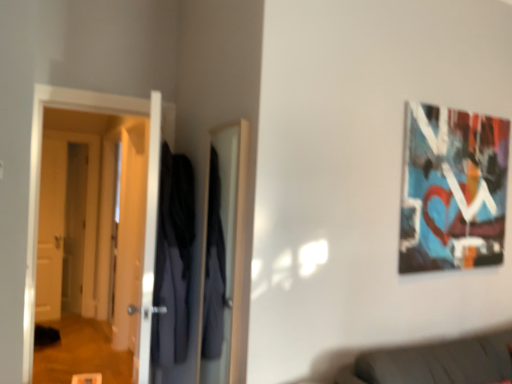
Question: Can you confirm if dark blue fabric robe at center is bigger than white glossy door at left, the first door viewed from the front?

Choices:
 (A) yes
 (B) no

Answer: (B)

Question: From the image's perspective, is dark blue fabric robe at center on top of white glossy door at left, arranged as the 1th door when viewed from the right?

Choices:
 (A) no
 (B) yes

Answer: (A)

Question: Is dark blue fabric robe at center positioned in front of white glossy door at left, arranged as the 1th door when viewed from the right?

Choices:
 (A) yes
 (B) no

Answer: (A)

Question: From the image's perspective, is dark blue fabric robe at center below white glossy door at left, the first door viewed from the front?

Choices:
 (A) yes
 (B) no

Answer: (A)

Question: Can you confirm if dark blue fabric robe at center is positioned to the right of white glossy door at left, arranged as the 1th door when viewed from the right?

Choices:
 (A) yes
 (B) no

Answer: (A)

Question: Which is correct: white wooden door at left, the 1th door in the back-to-front sequence, is inside dark blue fabric robe at center, or outside of it?

Choices:
 (A) outside
 (B) inside

Answer: (A)

Question: Based on their sizes in the image, would you say white wooden door at left, the 1th door in the back-to-front sequence, is bigger or smaller than dark blue fabric robe at center?

Choices:
 (A) small
 (B) big

Answer: (A)

Question: Is white wooden door at left, which is the second door from right to left, to the left or to the right of dark blue fabric robe at center in the image?

Choices:
 (A) right
 (B) left

Answer: (B)

Question: Is white wooden door at left, positioned as the 2th door in left-to-right order, wider or thinner than dark blue fabric robe at center?

Choices:
 (A) wide
 (B) thin

Answer: (B)

Question: From their relative heights in the image, would you say dark blue fabric robe at center is taller or shorter than white wooden door at left, which is the third door in front-to-back order?

Choices:
 (A) short
 (B) tall

Answer: (A)

Question: Looking at their shapes, would you say dark blue fabric robe at center is wider or thinner than white wooden door at left, which is the second door from right to left?

Choices:
 (A) thin
 (B) wide

Answer: (B)

Question: From a real-world perspective, is dark blue fabric robe at center physically located above or below white wooden door at left, positioned as the 2th door in left-to-right order?

Choices:
 (A) above
 (B) below

Answer: (A)

Question: Considering the positions of point (185, 198) and point (77, 137), is point (185, 198) closer or farther from the camera than point (77, 137)?

Choices:
 (A) closer
 (B) farther

Answer: (A)

Question: Considering their positions, is white glossy door at left, acting as the 3th door starting from the back, located in front of or behind white wooden door at left, which is the third door in front-to-back order?

Choices:
 (A) behind
 (B) front

Answer: (B)

Question: Looking at the image, does white glossy door at left, arranged as the 1th door when viewed from the right, seem bigger or smaller compared to white wooden door at left, positioned as the 2th door in left-to-right order?

Choices:
 (A) small
 (B) big

Answer: (B)